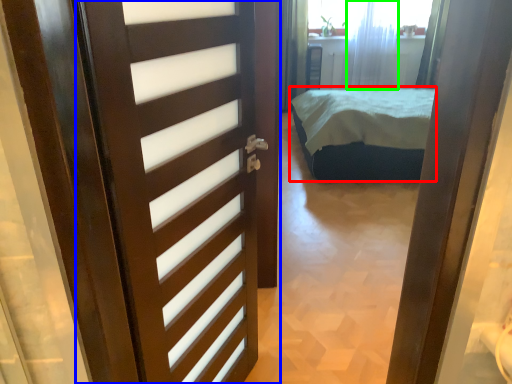
Question: Which object is the closest to the bed (highlighted by a red box)? Choose among these: door (highlighted by a blue box) or curtain (highlighted by a green box).

Choices:
 (A) door
 (B) curtain

Answer: (B)